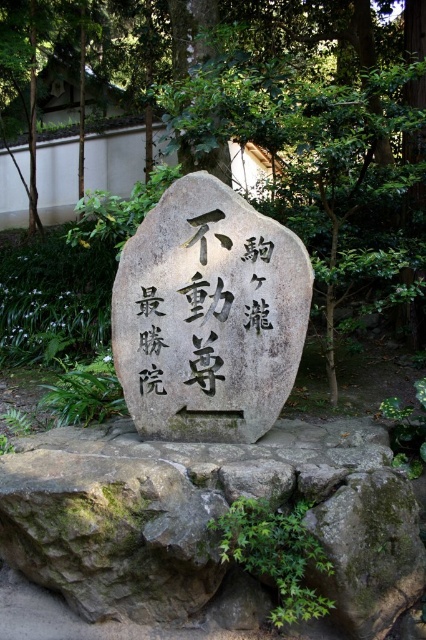
Question: Which of the following is the closest to the observer?

Choices:
 (A) (351, 566)
 (B) (57, 253)
 (C) (204, 321)
 (D) (242, 333)

Answer: (A)

Question: Does gray rough stone at center appear over gray stone boulder at center?

Choices:
 (A) yes
 (B) no

Answer: (B)

Question: Among these objects, which one is nearest to the camera?

Choices:
 (A) green leafy tree at center
 (B) black stone writing at center
 (C) gray rough stone at center
 (D) gray stone boulder at center

Answer: (C)

Question: Among these points, which one is nearest to the camera?

Choices:
 (A) (39, 150)
 (B) (83, 432)
 (C) (186, 346)
 (D) (161, 202)

Answer: (C)

Question: Is gray stone boulder at center bigger than black stone writing at center?

Choices:
 (A) no
 (B) yes

Answer: (B)

Question: Does green leafy tree at center have a larger size compared to black stone writing at center?

Choices:
 (A) no
 (B) yes

Answer: (B)